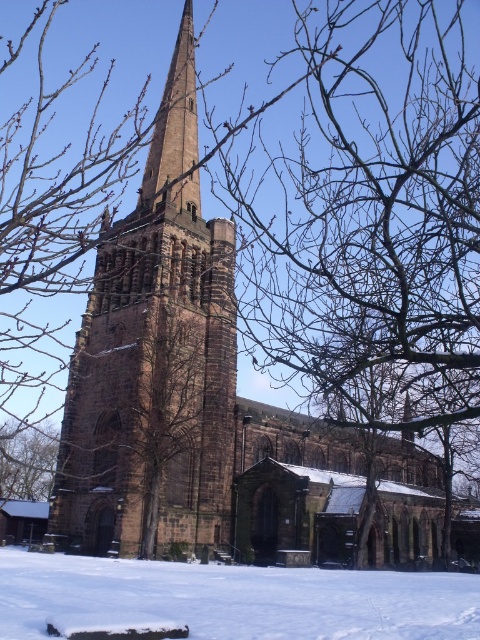
You are standing in front of the historic stone church and notice a specific point marked at coordinates (155, 358). Based on the scene description, can you identify which part of the church this point corresponds to?

The point at coordinates (155, 358) is located on the brown stone tower at center, which is the spire of the church.

You are standing in front of the historic stone church and want to walk towards the brown textured tree at lower left. Which direction should you turn to avoid stepping on the white powdery snow at lower center?

The white powdery snow at lower center is to the right of the brown textured tree at lower left. To avoid stepping on the snow, you should turn left towards the brown textured tree at lower left.

You are standing in front of the historic stone church and want to take a photo of the brown stone tower at center and the white powdery snow at lower center. From your current position, which object is closer to you?

The white powdery snow at lower center is closer to you because it is positioned under the brown stone tower at center, meaning the snow is in the foreground while the tower is elevated above it.